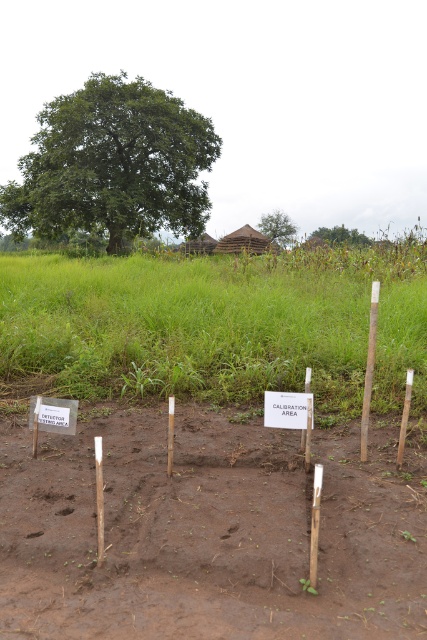
Question: Which point is farther to the camera?

Choices:
 (A) (409, 384)
 (B) (263, 417)

Answer: (B)

Question: Which of the following is the farthest from the observer?

Choices:
 (A) brown soil at center
 (B) green grass at center

Answer: (B)

Question: Can you confirm if green leafy tree at upper left is wider than white wood pole at right?

Choices:
 (A) yes
 (B) no

Answer: (A)

Question: Does green grass at center appear on the left side of white paper sign at center?

Choices:
 (A) no
 (B) yes

Answer: (B)

Question: Which object appears farthest from the camera in this image?

Choices:
 (A) brown soil at center
 (B) green leafy tree at upper center
 (C) green leafy tree at upper left

Answer: (B)

Question: Observing the image, what is the correct spatial positioning of green leafy tree at upper center in reference to brown wooden pole at center-right?

Choices:
 (A) left
 (B) right

Answer: (B)